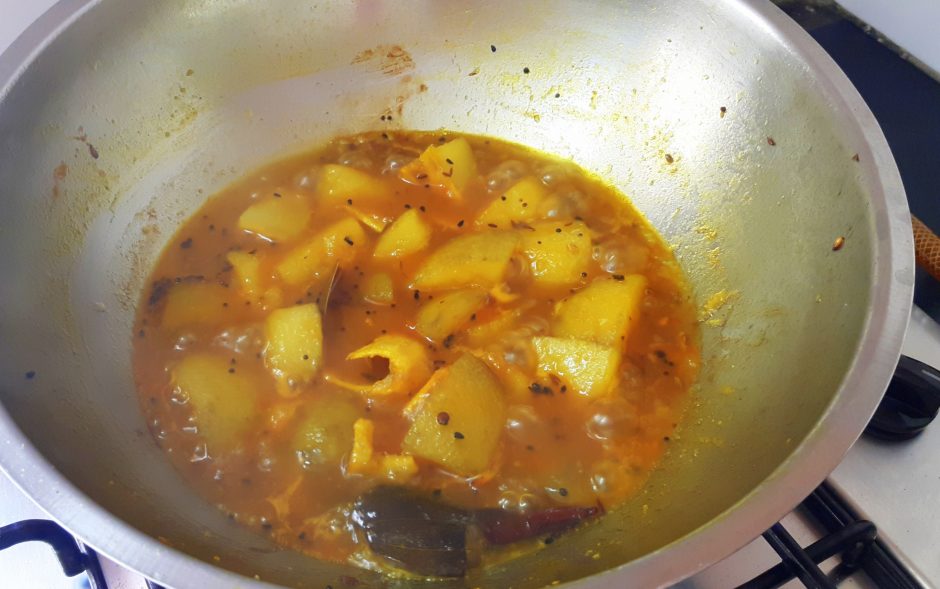
The width and height of the screenshot is (940, 589). I want to click on counter, so click(x=900, y=495).